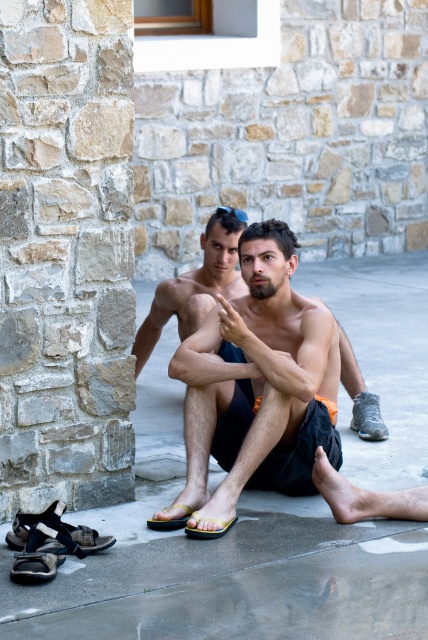
The width and height of the screenshot is (428, 640). Describe the element at coordinates (35, 566) in the screenshot. I see `brown leather sandal at lower left` at that location.

Can you confirm if brown leather sandal at lower left is bigger than yellow matte sandal at lower center?

Yes, brown leather sandal at lower left is bigger than yellow matte sandal at lower center.

This screenshot has width=428, height=640. What do you see at coordinates (35, 566) in the screenshot?
I see `brown leather sandal at lower left` at bounding box center [35, 566].

Identify the location of brown leather sandal at lower left. (35, 566).

Is gray concrete pavement at center shorter than white mesh sneaker at lower right?

Correct, gray concrete pavement at center is not as tall as white mesh sneaker at lower right.

The height and width of the screenshot is (640, 428). Identify the location of gray concrete pavement at center. (228, 577).

Find the location of a particular element. gray concrete pavement at center is located at coordinates (228, 577).

Who is lower down, black leather sandal at lower left or white mesh sneaker at lower right?

black leather sandal at lower left is below.

Does point (71, 538) come in front of point (372, 435)?

Yes, it is in front of point (372, 435).

Between point (83, 547) and point (377, 404), which one is positioned in front?

Point (83, 547)

Where is `black leather sandal at lower left`? This screenshot has width=428, height=640. black leather sandal at lower left is located at coordinates (56, 529).